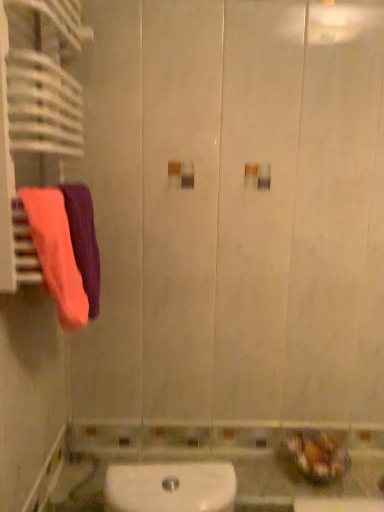
Question: Is point (84, 281) positioned closer to the camera than point (56, 284)?

Choices:
 (A) farther
 (B) closer

Answer: (A)

Question: Is orange fabric towel at left, arranged as the 1th towel when viewed from the back, inside or outside of fluffy cotton towel at left, which is counted as the second towel, starting from the back?

Choices:
 (A) outside
 (B) inside

Answer: (A)

Question: In terms of size, does orange fabric towel at left, arranged as the 1th towel when viewed from the back, appear bigger or smaller than fluffy cotton towel at left, which is counted as the second towel, starting from the back?

Choices:
 (A) big
 (B) small

Answer: (A)

Question: Considering the relative positions of fluffy cotton towel at left, arranged as the first towel when viewed from the front, and orange fabric towel at left, the second towel viewed from the front, in the image provided, is fluffy cotton towel at left, arranged as the first towel when viewed from the front, to the left or to the right of orange fabric towel at left, the second towel viewed from the front,?

Choices:
 (A) right
 (B) left

Answer: (B)

Question: Considering the positions of fluffy cotton towel at left, arranged as the first towel when viewed from the front, and orange fabric towel at left, the second towel viewed from the front, in the image, is fluffy cotton towel at left, arranged as the first towel when viewed from the front, taller or shorter than orange fabric towel at left, the second towel viewed from the front,?

Choices:
 (A) short
 (B) tall

Answer: (A)

Question: Would you say fluffy cotton towel at left, arranged as the first towel when viewed from the front, is inside or outside orange fabric towel at left, arranged as the 1th towel when viewed from the back?

Choices:
 (A) inside
 (B) outside

Answer: (A)

Question: From the image's perspective, is fluffy cotton towel at left, which is counted as the second towel, starting from the back, located above or below orange fabric towel at left, arranged as the 1th towel when viewed from the back?

Choices:
 (A) above
 (B) below

Answer: (B)